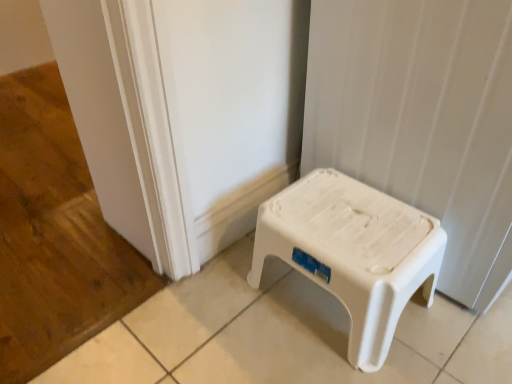
Find the location of a particular element. This screenshot has height=384, width=512. empty space that is ontop of white plastic stool at center is located at coordinates (347, 214).